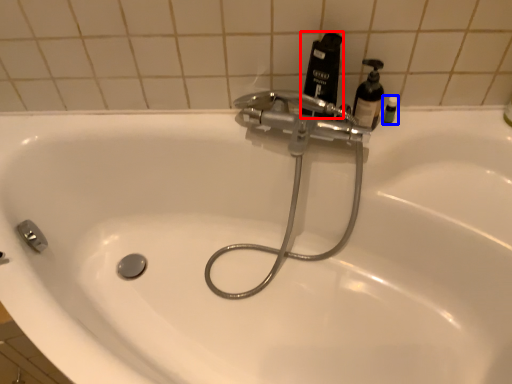
Question: Which object is closer to the camera taking this photo, mouthwash (highlighted by a red box) or toiletry (highlighted by a blue box)?

Choices:
 (A) mouthwash
 (B) toiletry

Answer: (A)